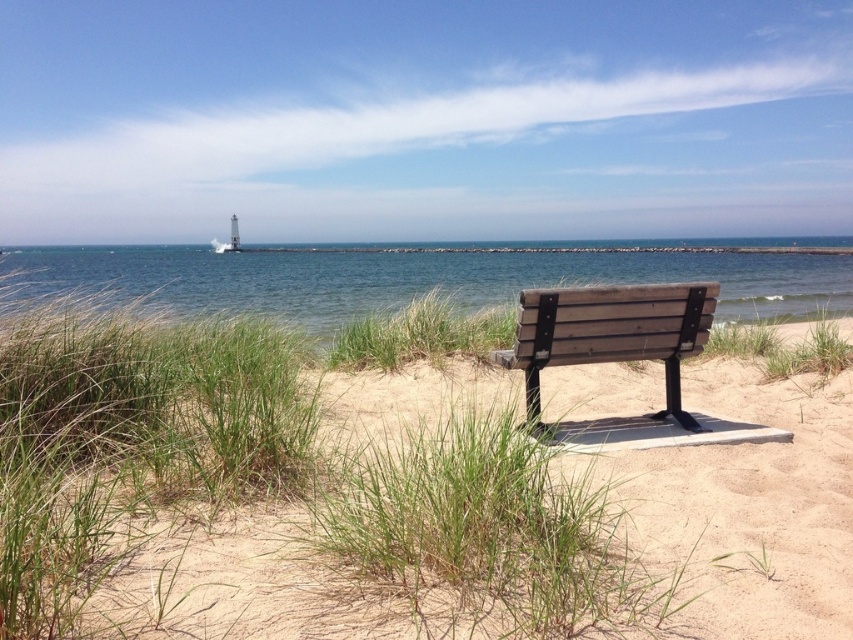
Who is positioned more to the right, green grass at center or clear blue water at center?

From the viewer's perspective, green grass at center appears more on the right side.

Does green grass at center have a lesser width compared to clear blue water at center?

Yes, green grass at center is thinner than clear blue water at center.

Image resolution: width=853 pixels, height=640 pixels. Find the location of `green grass at center`. green grass at center is located at coordinates (393, 490).

Can you confirm if clear blue water at center is smaller than wooden bench at center?

No, clear blue water at center is not smaller than wooden bench at center.

Where is `clear blue water at center`? This screenshot has width=853, height=640. clear blue water at center is located at coordinates (403, 280).

Is point (6, 333) farther from viewer compared to point (534, 376)?

No.

Which of these two, green grass at center or wooden bench at center, stands taller?

Standing taller between the two is green grass at center.

Is point (751, 522) farther from camera compared to point (688, 285)?

That is False.

The image size is (853, 640). Find the location of `green grass at center`. green grass at center is located at coordinates (393, 490).